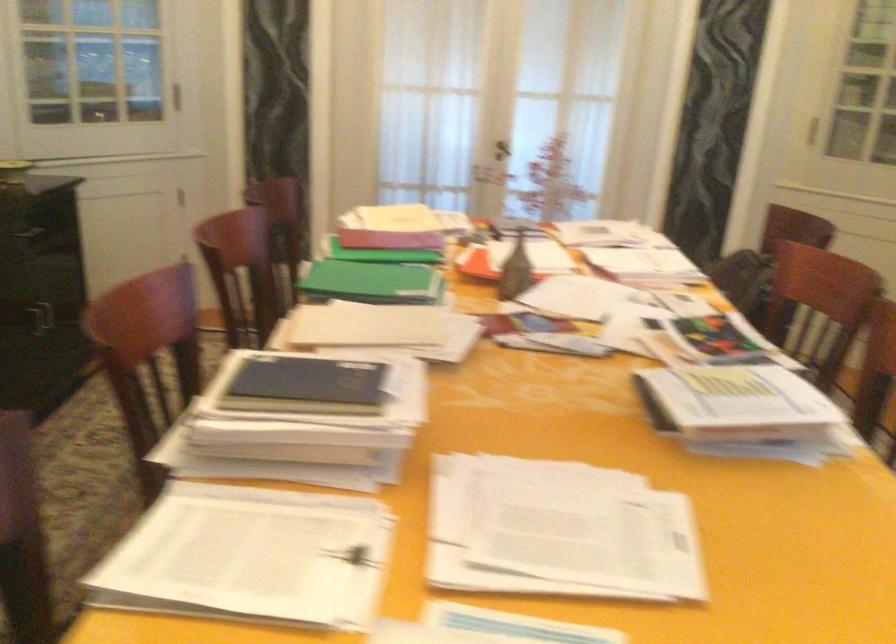
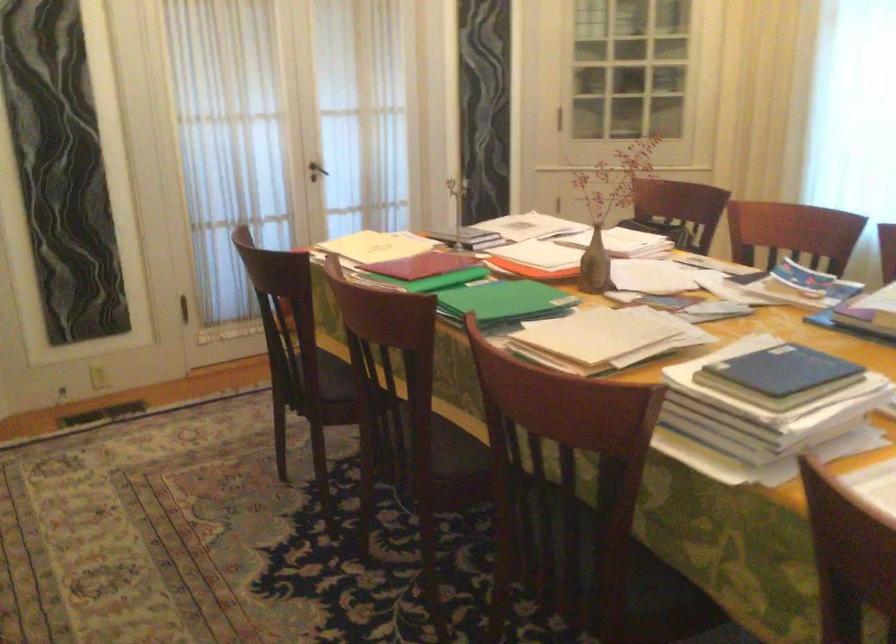
Find the pixel in the second image that matches point (391, 240) in the first image.

(423, 265)